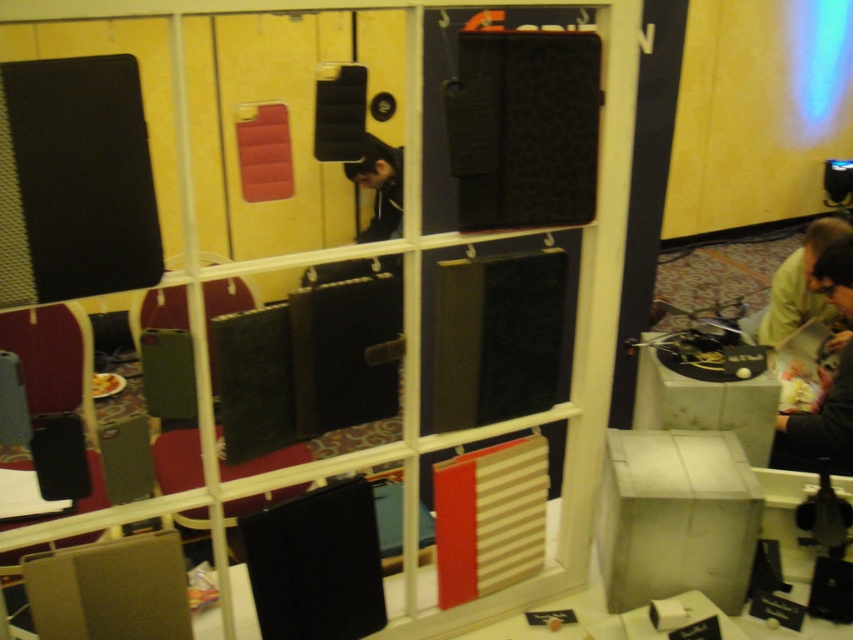
Question: Which point is closer to the camera taking this photo?

Choices:
 (A) (816, 227)
 (B) (380, 205)

Answer: (A)

Question: Is yellow matte shirt at lower right bigger than black matte jacket at center?

Choices:
 (A) yes
 (B) no

Answer: (A)

Question: Is yellow matte shirt at lower right below black matte jacket at center?

Choices:
 (A) no
 (B) yes

Answer: (B)

Question: Does light beige fabric at lower right appear on the left side of black matte jacket at center?

Choices:
 (A) no
 (B) yes

Answer: (A)

Question: Considering the real-world distances, which object is farthest from the light beige fabric at lower right?

Choices:
 (A) black matte jacket at center
 (B) yellow matte shirt at lower right

Answer: (A)

Question: Among these points, which one is farthest from the camera?

Choices:
 (A) (401, 204)
 (B) (775, 298)

Answer: (A)